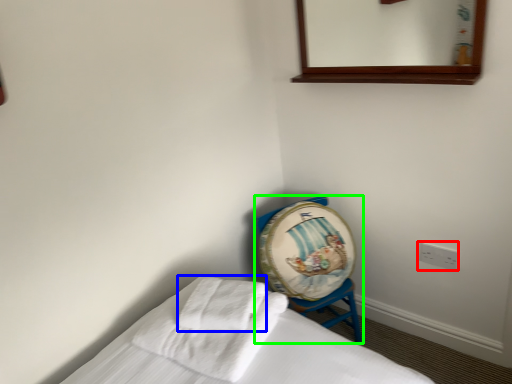
Question: Which object is the farthest from electric outlet (highlighted by a red box)? Choose among these: bath towel (highlighted by a blue box) or furniture (highlighted by a green box).

Choices:
 (A) bath towel
 (B) furniture

Answer: (A)